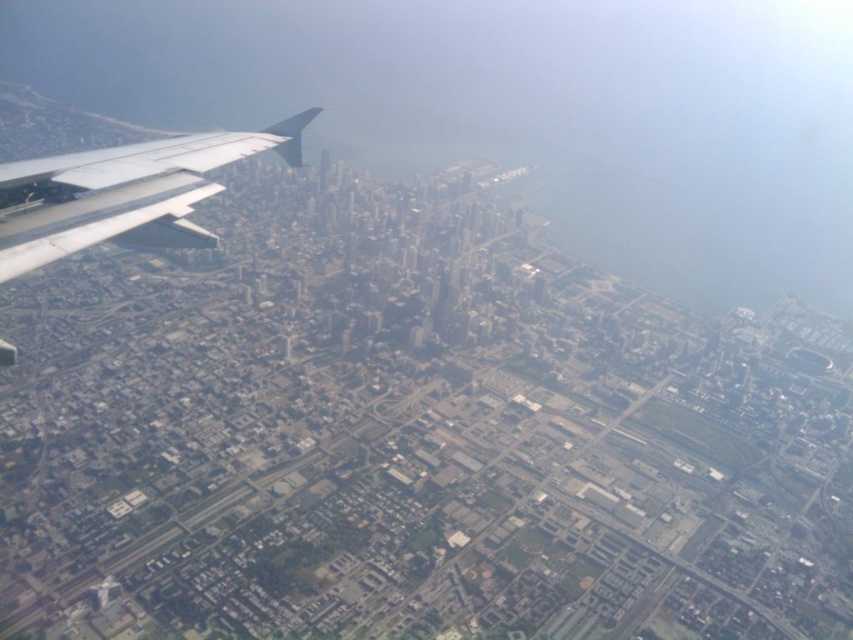
Question: Is transparent glass cityscape at upper center closer to camera compared to silver metallic wing at upper left?

Choices:
 (A) yes
 (B) no

Answer: (B)

Question: Which object appears closest to the camera in this image?

Choices:
 (A) silver metallic wing at upper left
 (B) transparent glass cityscape at upper center

Answer: (A)

Question: Is transparent glass cityscape at upper center to the right of silver metallic wing at upper left from the viewer's perspective?

Choices:
 (A) yes
 (B) no

Answer: (A)

Question: Does transparent glass cityscape at upper center appear over silver metallic wing at upper left?

Choices:
 (A) yes
 (B) no

Answer: (A)

Question: Which object appears closest to the camera in this image?

Choices:
 (A) transparent glass cityscape at upper center
 (B) silver metallic wing at upper left

Answer: (B)